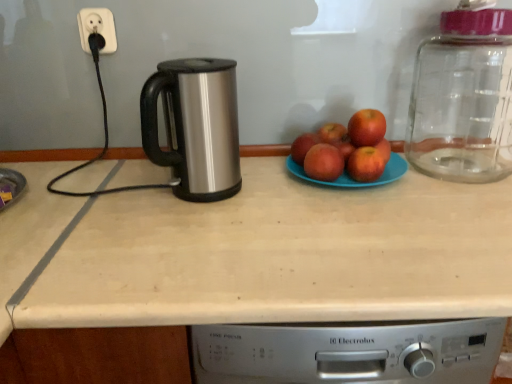
I want to click on vacant region to the left of polished stainless steel kettle at center, so click(124, 198).